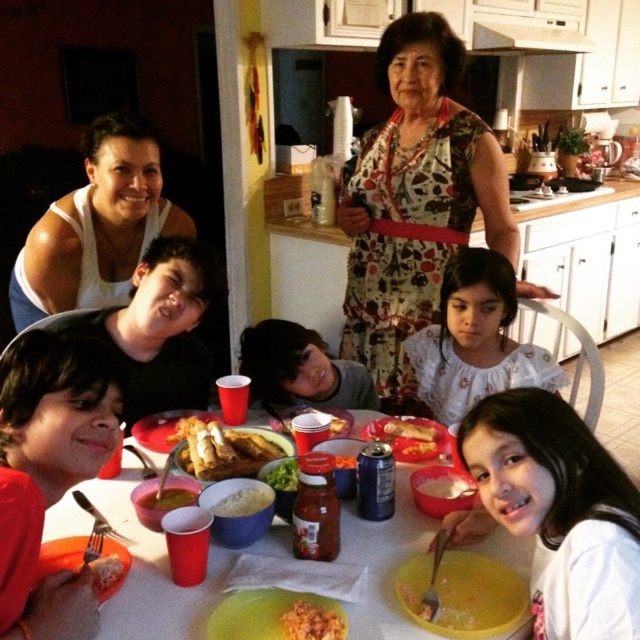
You are a guest at the family gathering and want to reach for the white creamy rice at center without spilling the matte red cup at lower left. Is the cup blocking your path to the rice?

The matte red cup at lower left is positioned over white creamy rice at center, so reaching for the rice would require moving the cup first to avoid spilling it.

You are a server in a busy restaurant and need to quickly grab the matte red cup at lower left and the white creamy rice at center from the table. What is the shortest distance you need to cover between these two items?

The shortest distance between the matte red cup at lower left and the white creamy rice at center is 26.22 inches.